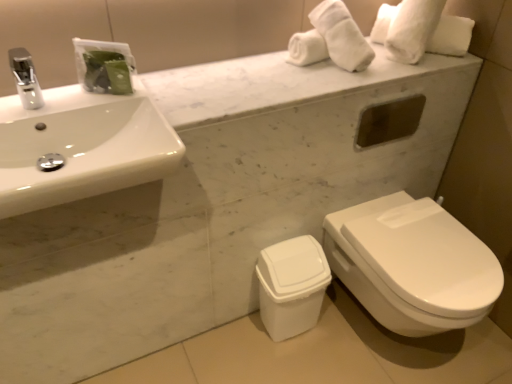
This screenshot has height=384, width=512. I want to click on free space behind silver metallic faucet at upper left, so click(50, 89).